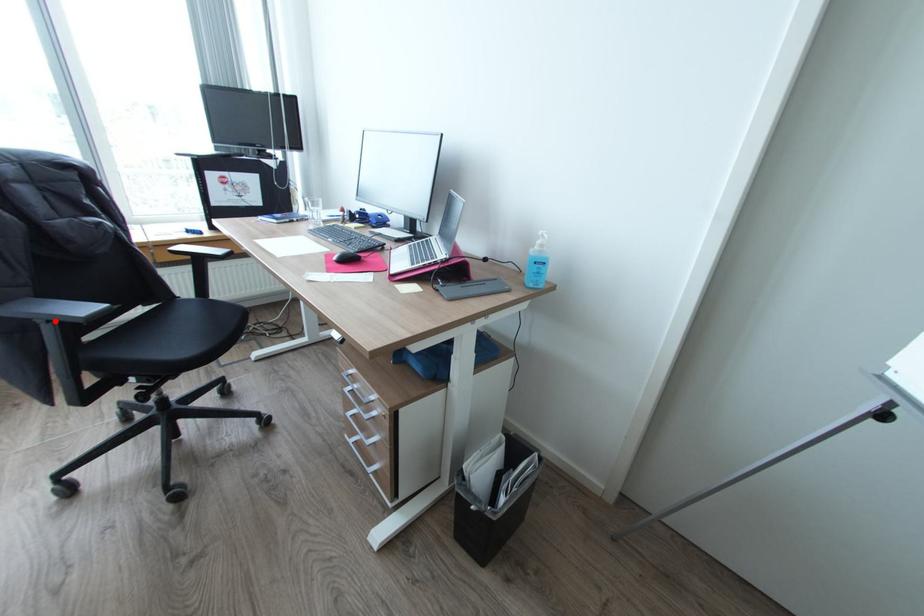
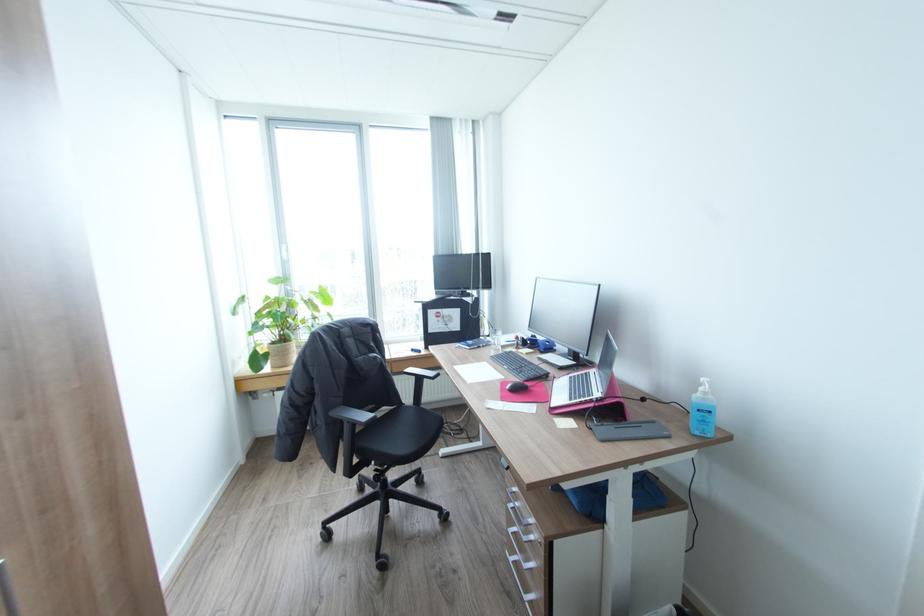
In the second image, find the point that corresponds to the highlighted location in the first image.

(354, 422)